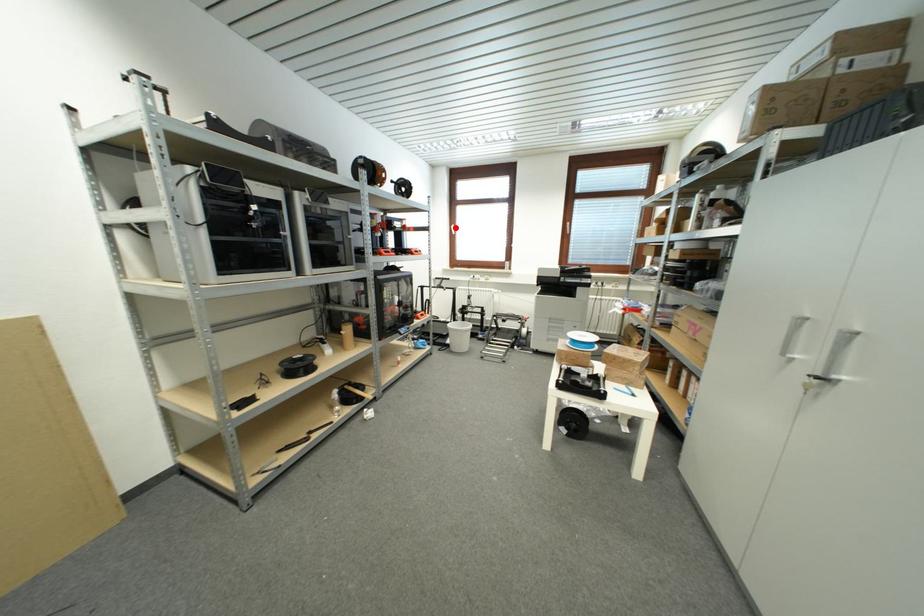
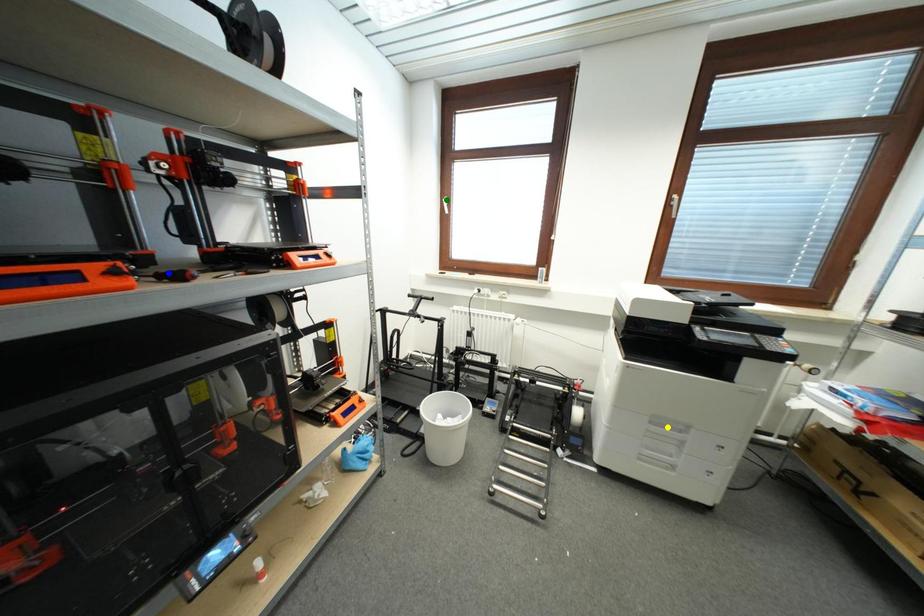
Question: I am providing you with two images of the same scene from different viewpoints. A red point is marked on the first image. You are given multiple points on the second image. Which point in image 2 is actually the same real-world point as the red point in image 1?

Choices:
 (A) green point
 (B) blue point
 (C) yellow point

Answer: (A)